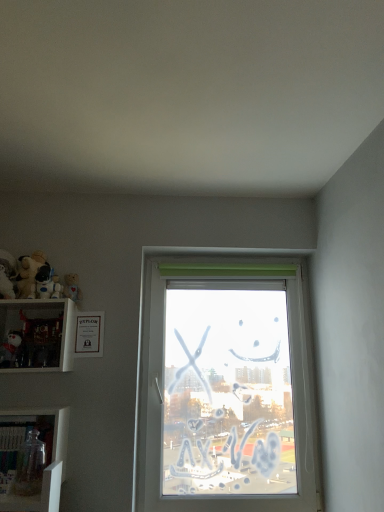
Question: Is white plush toy at upper left, placed as the third toy when sorted from bottom to top, to the left of matte white plush at left, placed as the 4th toy when sorted from top to bottom, from the viewer's perspective?

Choices:
 (A) no
 (B) yes

Answer: (A)

Question: Is white plush toy at upper left, which appears as the third toy when viewed from the top, located outside matte white plush at left, placed as the 4th toy when sorted from top to bottom?

Choices:
 (A) no
 (B) yes

Answer: (B)

Question: Is white plush toy at upper left, placed as the third toy when sorted from bottom to top, not close to matte white plush at left, acting as the 2th toy starting from the bottom?

Choices:
 (A) no
 (B) yes

Answer: (A)

Question: Can you confirm if white plush toy at upper left, placed as the third toy when sorted from bottom to top, is shorter than matte white plush at left, placed as the 4th toy when sorted from top to bottom?

Choices:
 (A) no
 (B) yes

Answer: (B)

Question: Considering the relative sizes of white plush toy at upper left, which appears as the third toy when viewed from the top, and matte white plush at left, placed as the 4th toy when sorted from top to bottom, in the image provided, is white plush toy at upper left, which appears as the third toy when viewed from the top, thinner than matte white plush at left, placed as the 4th toy when sorted from top to bottom,?

Choices:
 (A) no
 (B) yes

Answer: (B)

Question: From the image's perspective, is white plush toy at upper left, placed as the third toy when sorted from bottom to top, on matte white plush at left, placed as the 4th toy when sorted from top to bottom?

Choices:
 (A) no
 (B) yes

Answer: (B)

Question: Would you say white glossy shelf at left, the second shelf when ordered from bottom to top, is outside transparent glass jar at lower left, the 1th toy from the bottom?

Choices:
 (A) yes
 (B) no

Answer: (A)

Question: From a real-world perspective, is white glossy shelf at left, the first shelf in the top-to-bottom sequence, under transparent glass jar at lower left, the 1th toy from the bottom?

Choices:
 (A) yes
 (B) no

Answer: (B)

Question: Is white glossy shelf at left, the second shelf when ordered from bottom to top, touching transparent glass jar at lower left, the fifth toy from the top?

Choices:
 (A) yes
 (B) no

Answer: (B)

Question: Is white glossy shelf at left, the second shelf when ordered from bottom to top, thinner than transparent glass jar at lower left, the fifth toy from the top?

Choices:
 (A) no
 (B) yes

Answer: (A)

Question: Considering the relative positions of white glossy shelf at left, the first shelf in the top-to-bottom sequence, and transparent glass jar at lower left, the fifth toy from the top, in the image provided, is white glossy shelf at left, the first shelf in the top-to-bottom sequence, to the right of transparent glass jar at lower left, the fifth toy from the top, from the viewer's perspective?

Choices:
 (A) yes
 (B) no

Answer: (B)

Question: Does white glossy shelf at left, the second shelf when ordered from bottom to top, have a greater width compared to transparent glass jar at lower left, the fifth toy from the top?

Choices:
 (A) yes
 (B) no

Answer: (A)

Question: From the image's perspective, is transparent glass jar at lower left, the fifth toy from the top, under matte white plush at left, placed as the 4th toy when sorted from top to bottom?

Choices:
 (A) no
 (B) yes

Answer: (B)